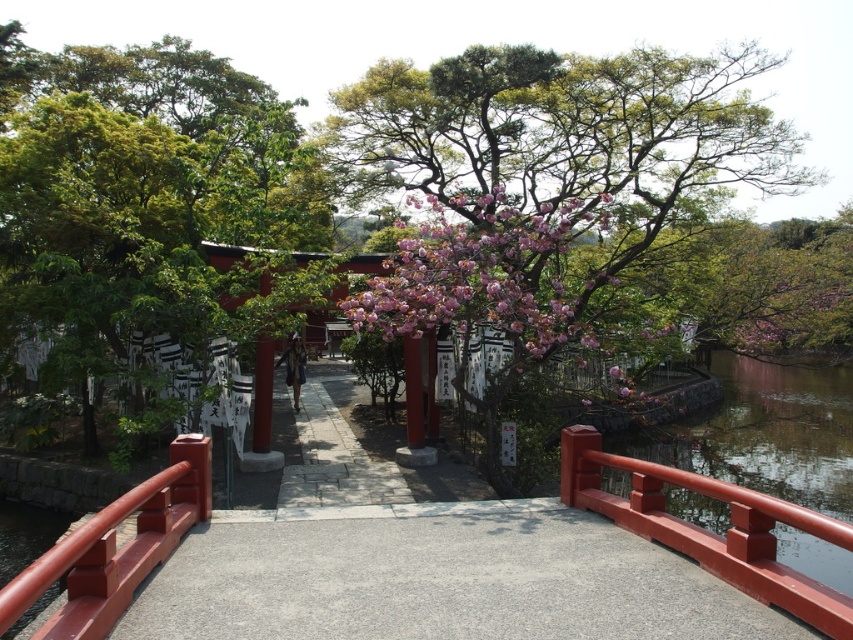
Question: Is pink blossoming tree at center to the left of paved stone path at center from the viewer's perspective?

Choices:
 (A) no
 (B) yes

Answer: (B)

Question: Can you confirm if smooth red railing at lower left is positioned to the left of paved stone path at center?

Choices:
 (A) yes
 (B) no

Answer: (B)

Question: Observing the image, what is the correct spatial positioning of pink blossoming tree at center in reference to paved stone path at center?

Choices:
 (A) left
 (B) right

Answer: (A)

Question: Based on their relative distances, which object is nearer to the paved stone path at center?

Choices:
 (A) pink blossoming tree at center
 (B) smooth red railing at lower left

Answer: (B)

Question: Which object appears closest to the camera in this image?

Choices:
 (A) smooth glossy wood rail at right
 (B) pink blossoming tree at center
 (C) smooth red railing at lower left

Answer: (C)

Question: Which object is positioned closest to the pink blossoming tree at center?

Choices:
 (A) smooth glossy wood rail at right
 (B) paved stone path at center

Answer: (B)